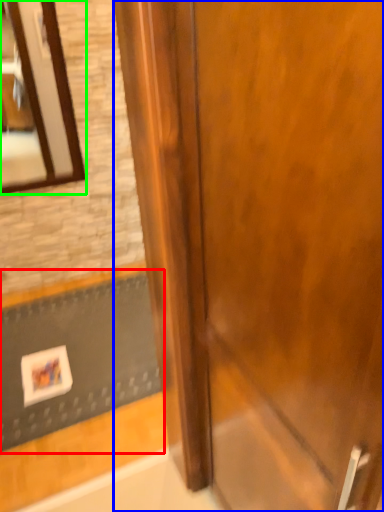
Question: Which object is positioned farthest from doormat (highlighted by a red box)? Select from door (highlighted by a blue box) and mirror (highlighted by a green box).

Choices:
 (A) door
 (B) mirror

Answer: (A)